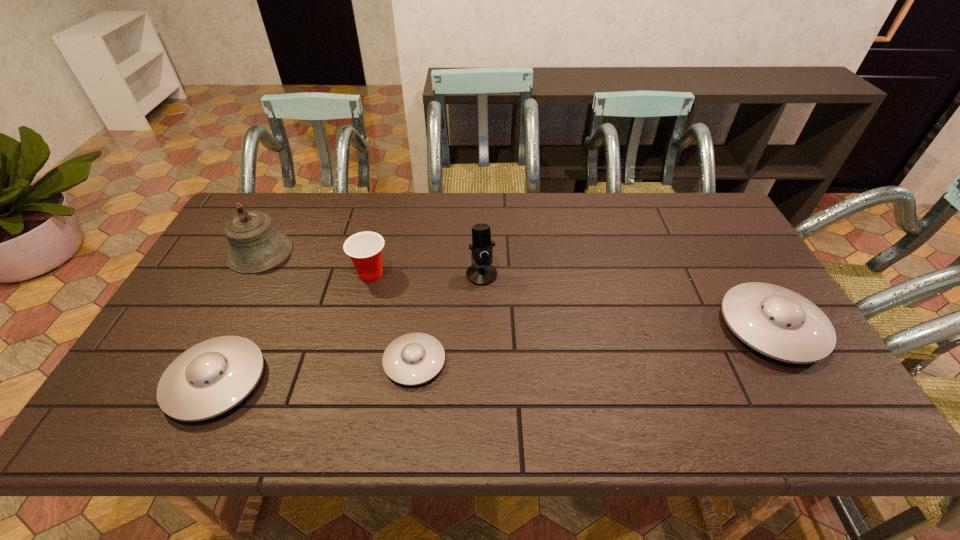
Find the location of a particular element. Image resolution: width=960 pixels, height=540 pixels. free space located on the back of the shortest saucer is located at coordinates (429, 243).

At what (x,y) coordinates should I click in order to perform the action: click on vacant space situated on the left of the rightmost object. Please return your answer as a coordinate pair (x, y). This screenshot has height=540, width=960. Looking at the image, I should click on (687, 327).

You are a GUI agent. You are given a task and a screenshot of the screen. Output one action in this format:
    pyautogui.click(x=<x>, y=<y>)
    Task: Click on the vacant space located on the front of the bell
    Image resolution: width=960 pixels, height=540 pixels.
    Given the screenshot: What is the action you would take?
    (x=232, y=305)

Identify the location of free location located 0.310m on the stand of the microphone. Image resolution: width=960 pixels, height=540 pixels. (482, 380).

I want to click on vacant area situated on the left of the third object from left to right, so click(229, 274).

The image size is (960, 540). I want to click on object that is at the far edge, so click(x=256, y=246).

Identify the location of saucer located in the left edge section of the desktop. (210, 378).

In order to click on bell that is at the left edge in this screenshot , I will do `click(256, 246)`.

You are a GUI agent. You are given a task and a screenshot of the screen. Output one action in this format:
    pyautogui.click(x=<x>, y=<y>)
    Task: Click on the object situated at the right edge
    The width and height of the screenshot is (960, 540).
    Given the screenshot: What is the action you would take?
    pyautogui.click(x=777, y=322)

In order to click on object that is at the far left corner in this screenshot , I will do `click(256, 246)`.